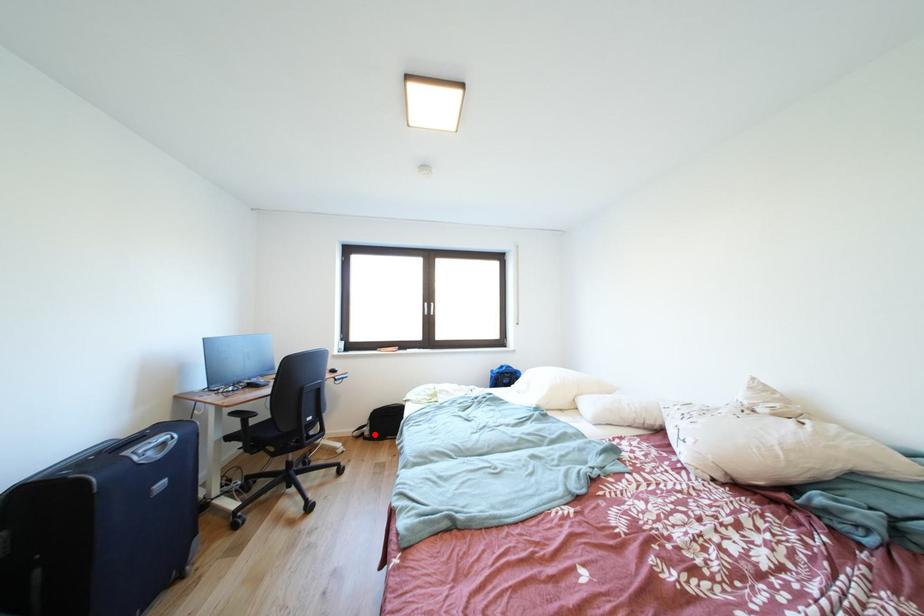
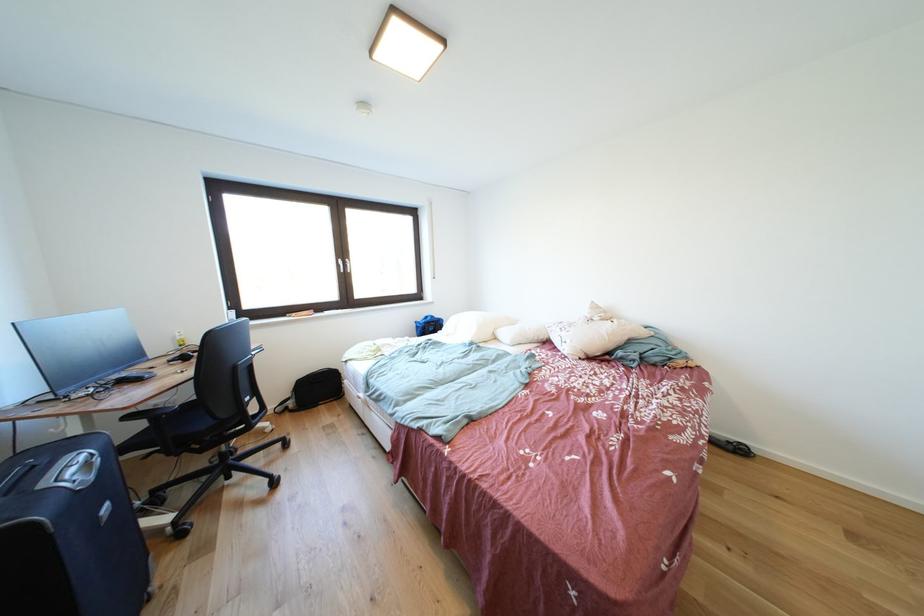
Question: A red point is marked in image1. In image2, is the corresponding 3D point closer to the camera or farther? Reply with the corresponding letter.

Choices:
 (A) The corresponding 3D point is closer.
 (B) The corresponding 3D point is farther.

Answer: (A)